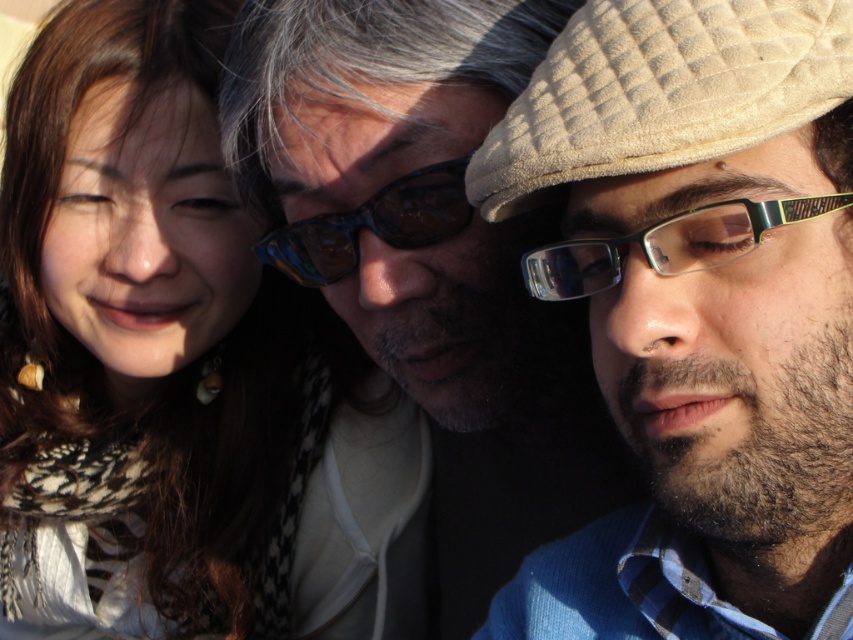
You are a photographer adjusting your camera settings to focus on two specific points in the image. The first point is at coordinates point [161,58] and the second is at point [367,225]. Which point should you focus on first if you want to ensure the closest object is in sharp focus?

Point [161,58] is further to the camera than point [367,225], so you should focus on point [161,58] first to capture the closest object in sharp focus.

You are a photographer trying to capture the sunglasses at center in your shot. The camera is positioned at the point with coordinates point (427,257). Can you confirm if the sunglasses at center are exactly at the camera position?

The point (427,257) marks the sunglasses at center, so yes, the sunglasses at center are exactly at the camera position.